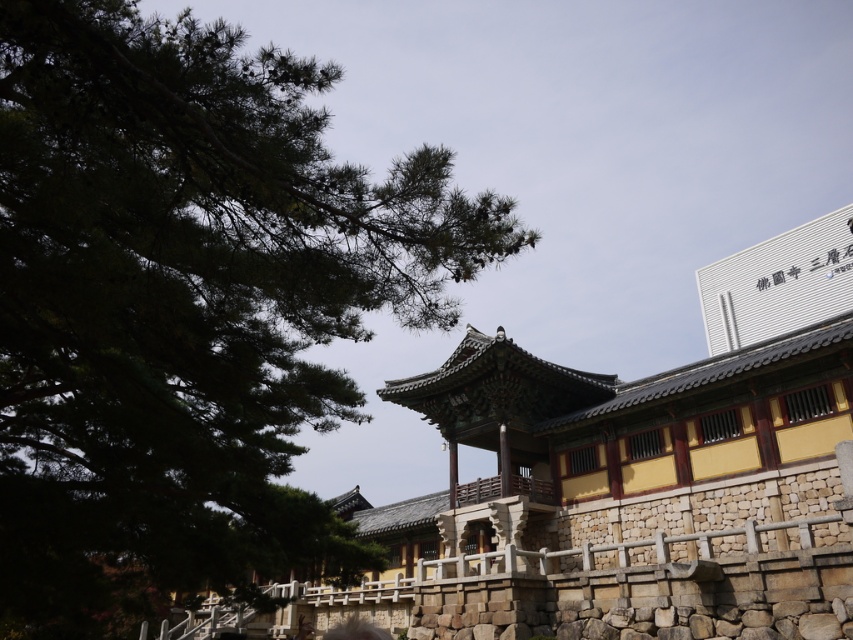
Question: Among these points, which one is farthest from the camera?

Choices:
 (A) (350, 624)
 (B) (287, 385)

Answer: (A)

Question: Which of the following is the closest to the observer?

Choices:
 (A) green leafy tree at upper left
 (B) smooth stone face at center

Answer: (A)

Question: Does green leafy tree at upper left appear over smooth stone face at center?

Choices:
 (A) yes
 (B) no

Answer: (A)

Question: Is green leafy tree at upper left above smooth stone face at center?

Choices:
 (A) yes
 (B) no

Answer: (A)

Question: Does green leafy tree at upper left have a smaller size compared to smooth stone face at center?

Choices:
 (A) yes
 (B) no

Answer: (B)